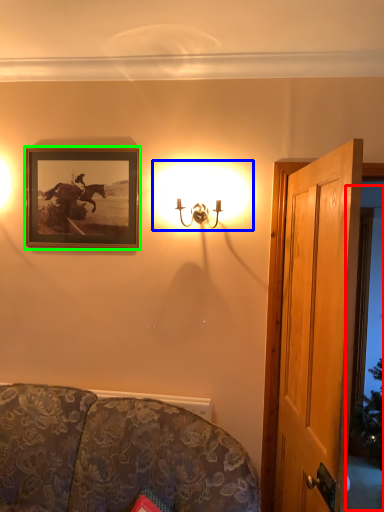
Question: Which object is the farthest from window (highlighted by a red box)? Choose among these: lamp (highlighted by a blue box) or picture frame (highlighted by a green box).

Choices:
 (A) lamp
 (B) picture frame

Answer: (B)